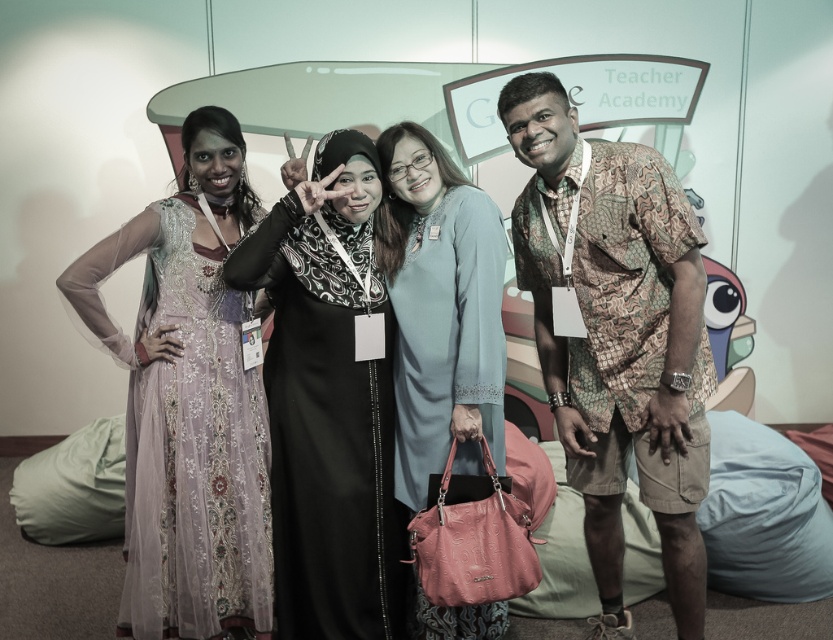
Question: Which is nearer to the light blue fabric dress at center?

Choices:
 (A) lavender sheer dress at left
 (B) black satin hijab at center

Answer: (B)

Question: Is brown patterned shirt at right below black satin hijab at center?

Choices:
 (A) no
 (B) yes

Answer: (A)

Question: Which point appears farthest from the camera in this image?

Choices:
 (A) (410, 422)
 (B) (646, 280)
 (C) (292, 259)
 (D) (207, 413)

Answer: (A)

Question: Considering the real-world distances, which object is farthest from the black satin hijab at center?

Choices:
 (A) brown patterned shirt at right
 (B) lavender sheer dress at left

Answer: (A)

Question: Can you confirm if lavender sheer dress at left is thinner than black satin hijab at center?

Choices:
 (A) no
 (B) yes

Answer: (A)

Question: Can you confirm if brown patterned shirt at right is positioned to the left of black satin hijab at center?

Choices:
 (A) no
 (B) yes

Answer: (A)